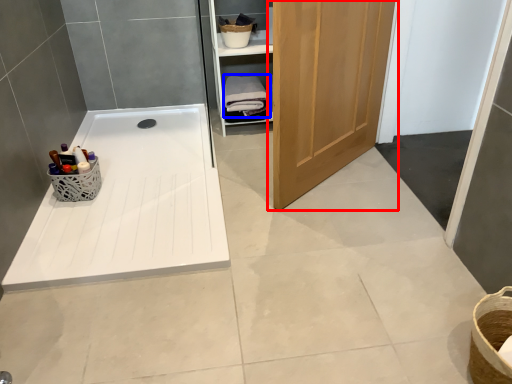
Question: Which point is closer to the camera, door (highlighted by a red box) or bath towel (highlighted by a blue box)?

Choices:
 (A) door
 (B) bath towel

Answer: (A)